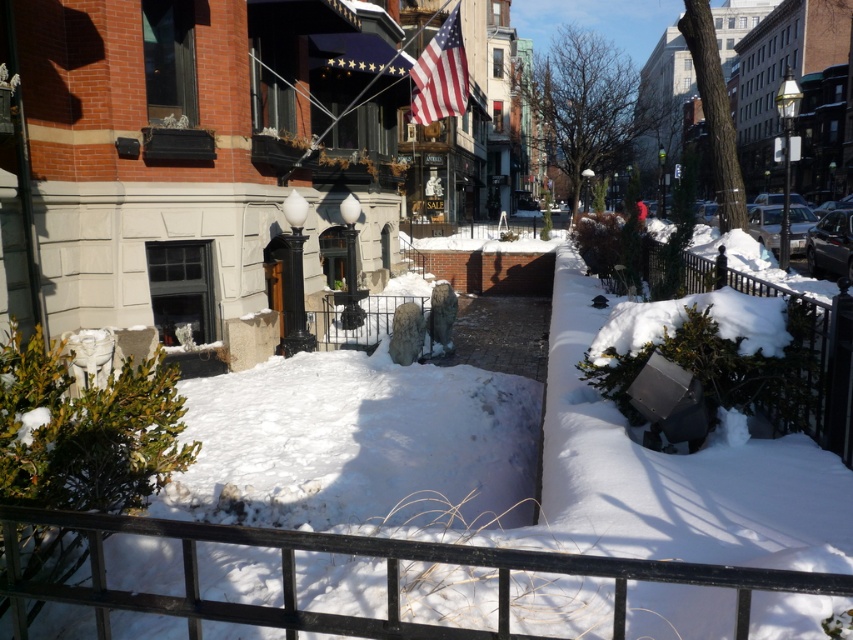
You are standing at the edge of a balcony overlooking a snowy garden. You want to place a small potted plant that requires 3 feet of space in front of the black metal fence at lower center. Is there enough space between you and the fence to accommodate the plant?

The distance between you and the black metal fence at lower center is 5.84 feet, which is more than the required 3 feet. Therefore, there is enough space to place the potted plant.

You are a photographer trying to capture both the black metal fence at lower center and the american flag at upper center in a single shot. Which object takes up more area in the photo?

The american flag at upper center takes up more area in the photo because the black metal fence at lower center occupies less space than the american flag at upper center.